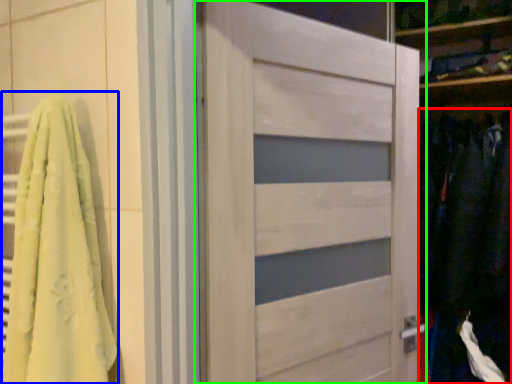
Question: Based on their relative distances, which object is nearer to clothing (highlighted by a red box)? Choose from bath towel (highlighted by a blue box) and door (highlighted by a green box).

Choices:
 (A) bath towel
 (B) door

Answer: (B)